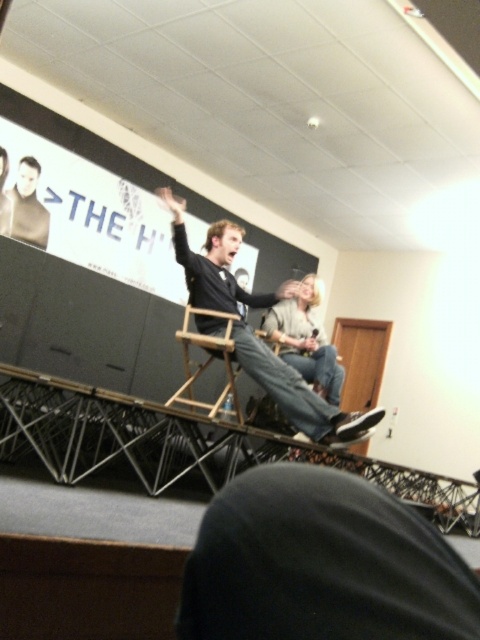
You are an event organizer setting up a presentation. You need to ensure that the white matte projection screen at upper center and the light gray sweater at center are visible to the audience. Given their sizes, which object should be placed closer to the front to ensure visibility?

The light gray sweater at center should be placed closer to the front because the white matte projection screen at upper center is already larger in size, so even if placed further back, it will still be visible. The smaller light gray sweater at center needs to be closer to ensure it is seen clearly by the audience.

You are an event organizer who needs to ensure that all participants can see the presenter clearly. Given the dark gray cotton shirt at center and the white matte projection screen at upper center, which object takes up more visual space in the scene?

The white matte projection screen at upper center takes up more visual space than the dark gray cotton shirt at center because the dark gray cotton shirt at center occupies less space than white matte projection screen at upper center.

You are an event planner trying to set up a camera to capture both the dark gray cotton shirt at center and the white matte projection screen at upper center during the event. Based on their sizes, which object should you focus on first to ensure both are in frame?

The dark gray cotton shirt at center is much taller than the white matte projection screen at upper center, so you should focus on framing the dark gray cotton shirt at center first to ensure the projection screen fits within the camera view.